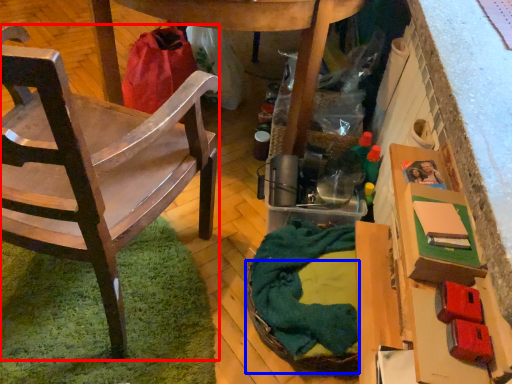
Question: Which of the following is the closest to the observer, chair (highlighted by a red box) or basket (highlighted by a blue box)?

Choices:
 (A) chair
 (B) basket

Answer: (A)